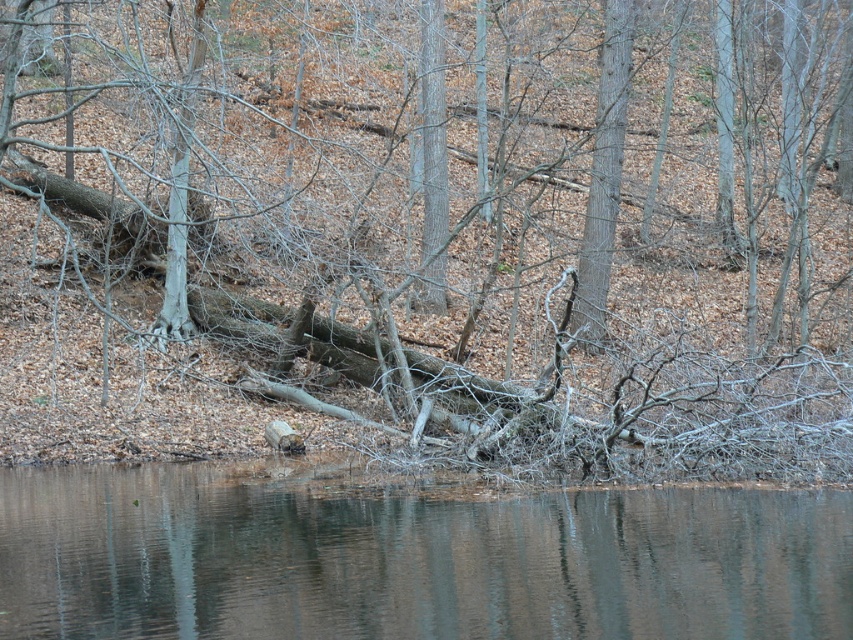
Where is the brown wood tree at center located in the image?

The brown wood tree at center is located at point (434, 221) in the image.

You are standing at the edge of the forest and want to walk to the smooth bark tree at center. Which direction should you head towards relative to the brown smooth water at lower center?

You should head to the right of the brown smooth water at lower center to reach the smooth bark tree at center because the brown smooth water at lower center is to the left of the smooth bark tree at center.

You are standing at the edge of the forest and see the brown smooth water at lower center and the smooth bark tree at center. Which object is closer to the ground?

The brown smooth water at lower center is closer to the ground because it is shorter than the smooth bark tree at center.